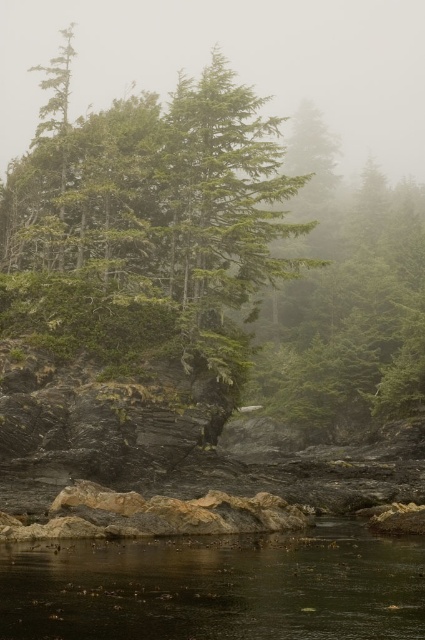
Question: Does green matte tree at center appear under foggy translucent mist at upper center?

Choices:
 (A) yes
 (B) no

Answer: (A)

Question: Is green matte tree at center to the left of dark brown water at lower center from the viewer's perspective?

Choices:
 (A) yes
 (B) no

Answer: (B)

Question: Which point is farther from the camera taking this photo?

Choices:
 (A) (0, 561)
 (B) (346, 413)

Answer: (B)

Question: Among these points, which one is farthest from the camera?

Choices:
 (A) (391, 148)
 (B) (130, 570)
 (C) (357, 246)

Answer: (A)

Question: Does foggy translucent mist at upper center have a lesser width compared to dark brown water at lower center?

Choices:
 (A) yes
 (B) no

Answer: (B)

Question: Which of the following is the closest to the observer?

Choices:
 (A) dark brown water at lower center
 (B) green matte tree at center

Answer: (A)